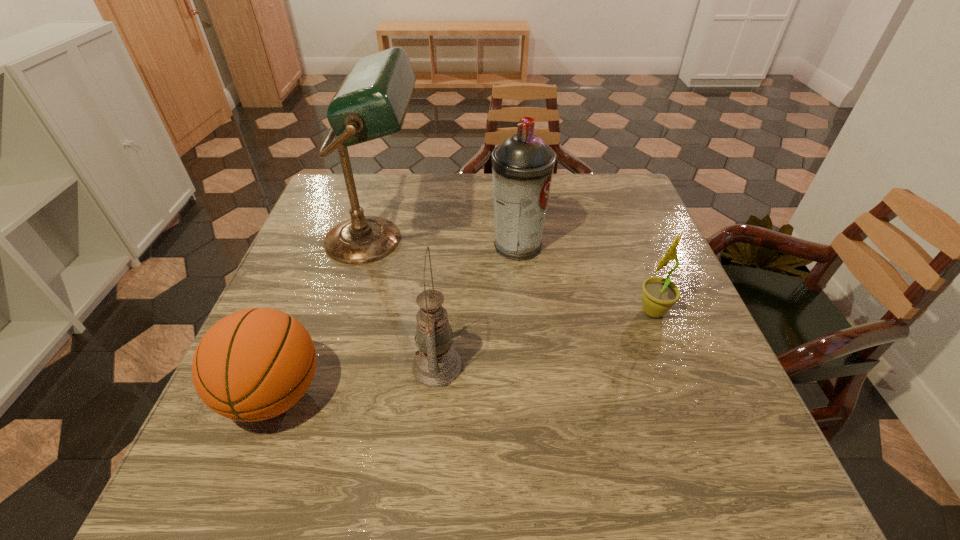
Where is `free space between the basketball and the aerosol can`? The image size is (960, 540). free space between the basketball and the aerosol can is located at coordinates (396, 320).

This screenshot has height=540, width=960. Identify the location of free space between the aerosol can and the basketball. point(396,320).

Identify the location of vacant point located between the third farthest object and the oil lamp. This screenshot has height=540, width=960. (545, 339).

Find the location of a particular element. The height and width of the screenshot is (540, 960). vacant space that's between the rightmost object and the third object from right to left is located at coordinates [545, 339].

Identify the location of empty space between the tallest object and the third tallest object. The image size is (960, 540). (406, 303).

Where is `object identified as the second closest to the table lamp`? This screenshot has width=960, height=540. object identified as the second closest to the table lamp is located at coordinates (522, 166).

Locate an element on the screen. This screenshot has width=960, height=540. object that ranks as the second closest to the third shortest object is located at coordinates (372, 101).

Where is `free space that satisfies the following two spatial constraints: 1. above the green lampshade of the third tallest object; 2. on the right side of the tallest object`? This screenshot has width=960, height=540. free space that satisfies the following two spatial constraints: 1. above the green lampshade of the third tallest object; 2. on the right side of the tallest object is located at coordinates (340, 366).

The image size is (960, 540). I want to click on vacant space that satisfies the following two spatial constraints: 1. above the green lampshade of the tallest object; 2. on the left side of the second object from right to left, so click(373, 246).

Locate an element on the screen. free region that satisfies the following two spatial constraints: 1. above the green lampshade of the table lamp; 2. on the right side of the second object from right to left is located at coordinates point(373,246).